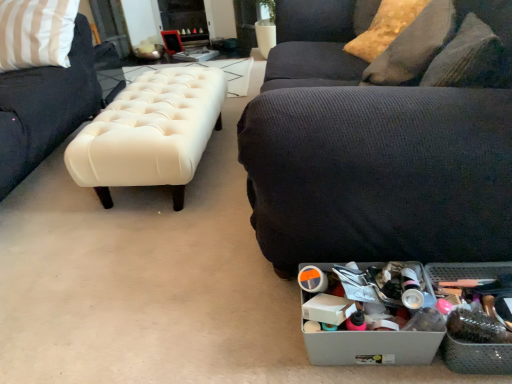
I want to click on free point above creamy leather bench at center (from a real-world perspective), so click(x=146, y=102).